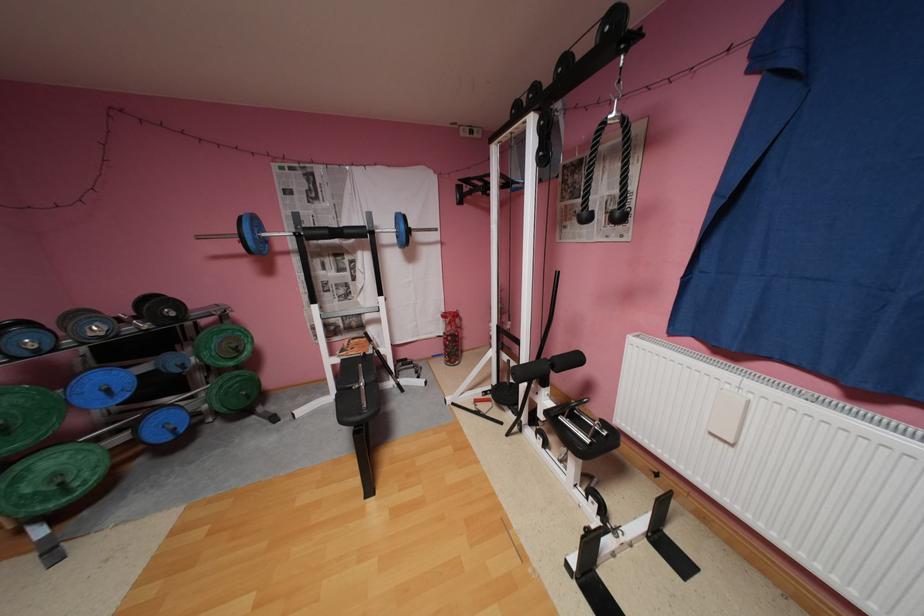
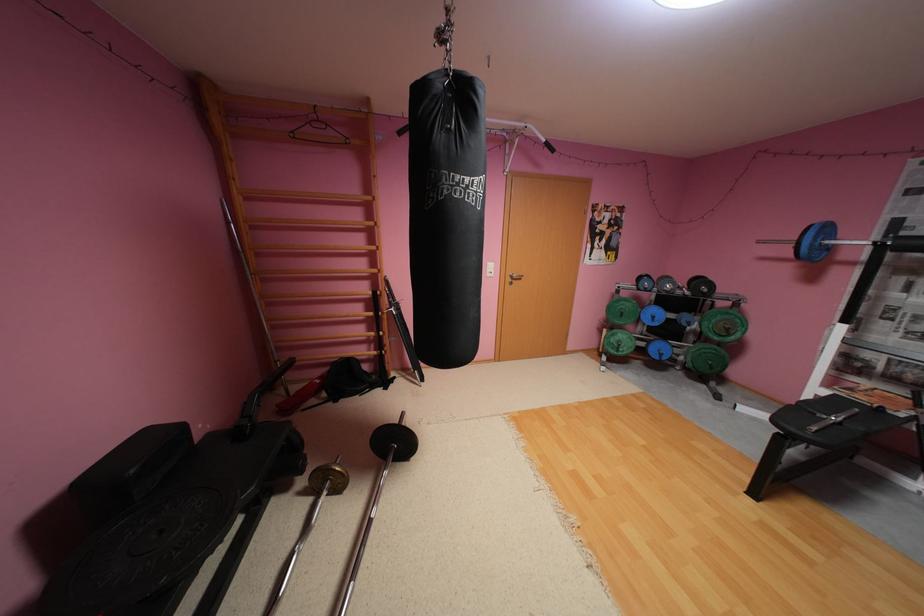
The point at (78,492) is marked in the first image. Where is the corresponding point in the second image?

(626, 351)